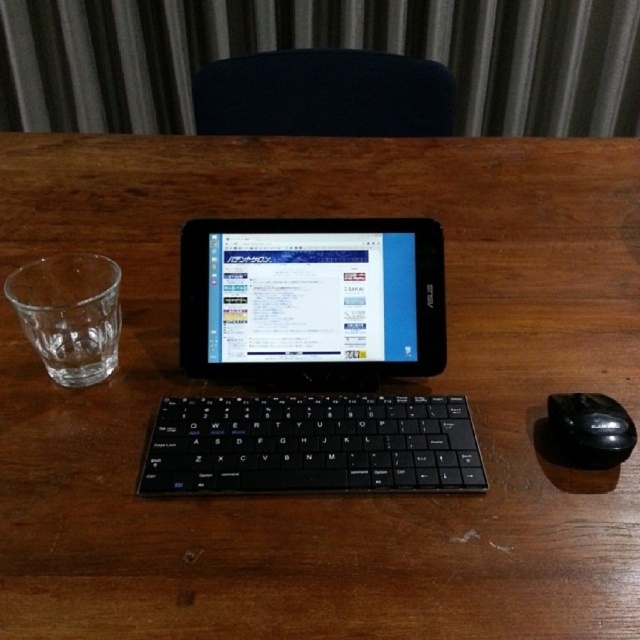
Question: Which point is closer to the camera taking this photo?

Choices:
 (A) (307, 128)
 (B) (269, 236)
 (C) (248, 401)
 (D) (68, 282)

Answer: (C)

Question: Considering the relative positions of dark blue fabric chair at upper center and black rubber mouse at right in the image provided, where is dark blue fabric chair at upper center located with respect to black rubber mouse at right?

Choices:
 (A) left
 (B) right

Answer: (A)

Question: Among these objects, which one is nearest to the camera?

Choices:
 (A) black plastic tablet at center
 (B) transparent glass at left
 (C) black plastic keyboard at center
 (D) black rubber mouse at right

Answer: (A)

Question: Considering the real-world distances, which object is closest to the transparent glass at left?

Choices:
 (A) dark blue fabric chair at upper center
 (B) black plastic tablet at center

Answer: (B)

Question: Is black plastic tablet at center further to the viewer compared to black plastic keyboard at center?

Choices:
 (A) no
 (B) yes

Answer: (A)

Question: In this image, where is black plastic tablet at center located relative to black rubber mouse at right?

Choices:
 (A) above
 (B) below

Answer: (A)